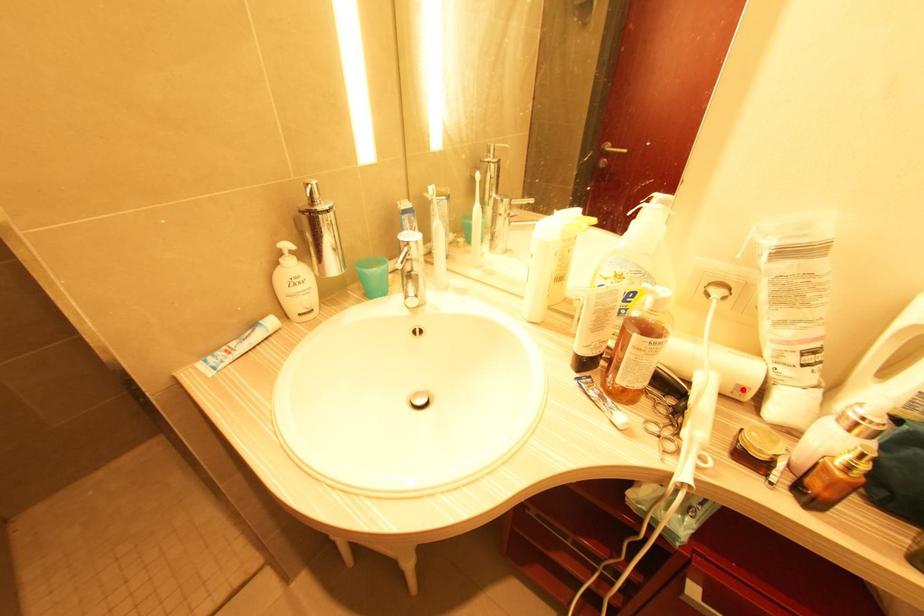
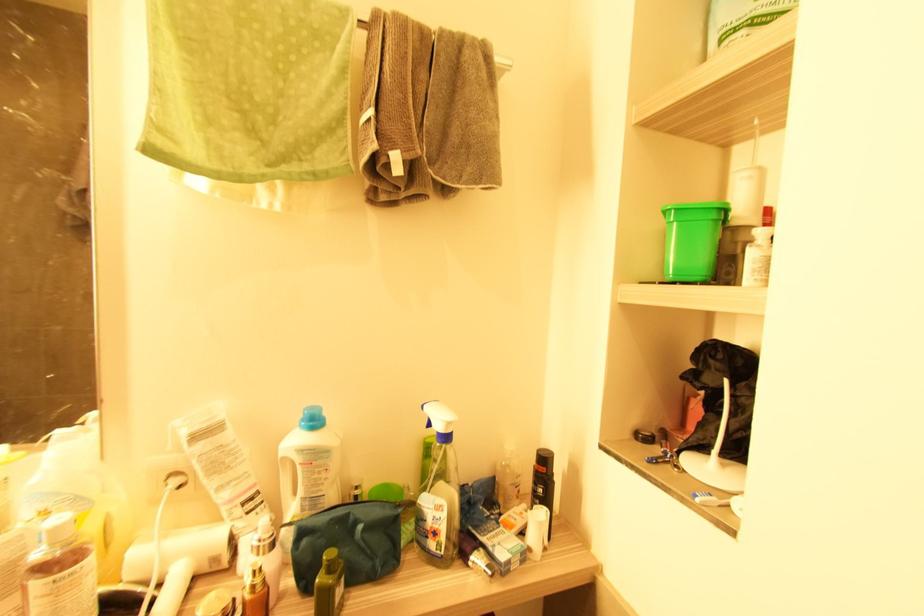
Locate, in the second image, the point that corresponds to the highlighted location in the first image.

(216, 561)